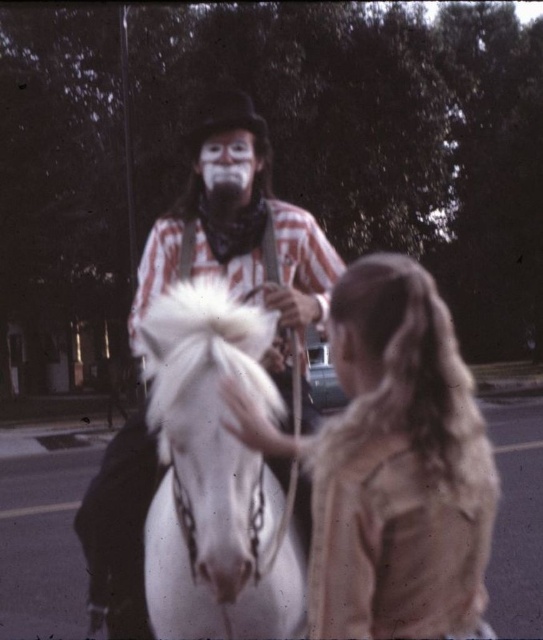
Can you confirm if light brown textured coat at center is positioned above white glossy horse at center?

Yes.

From the picture: Between light brown textured coat at center and white glossy horse at center, which one is positioned lower?

white glossy horse at center is lower down.

This screenshot has width=543, height=640. What are the coordinates of `light brown textured coat at center` in the screenshot? It's located at (393, 465).

Does light brown textured coat at center have a larger size compared to matte striped shirt at center?

Actually, light brown textured coat at center might be smaller than matte striped shirt at center.

Between light brown textured coat at center and matte striped shirt at center, which one has more height?

matte striped shirt at center is taller.

Who is more distant from viewer, (367,298) or (91,624)?

Point (91,624)

The height and width of the screenshot is (640, 543). Identify the location of light brown textured coat at center. (393, 465).

Is white glossy horse at center wider than matte striped shirt at center?

In fact, white glossy horse at center might be narrower than matte striped shirt at center.

Between white glossy horse at center and matte striped shirt at center, which one is positioned higher?

matte striped shirt at center is above.

Image resolution: width=543 pixels, height=640 pixels. Identify the location of white glossy horse at center. (214, 476).